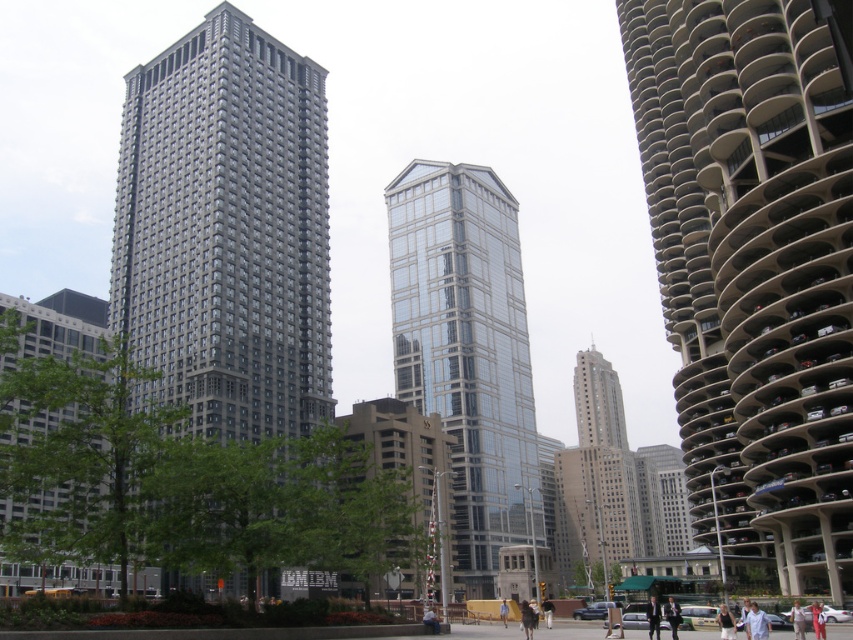
Question: Does light brown fabric pants at center have a larger size compared to light blue jeans at center?

Choices:
 (A) no
 (B) yes

Answer: (B)

Question: Estimate the real-world distances between objects in this image. Which object is farther from the light blue denim jeans at lower right?

Choices:
 (A) beige concrete parking garage at right
 (B) light blue jeans at center
 (C) white cotton shirt at lower right
 (D) dark suit at center

Answer: (A)

Question: Which object appears closest to the camera in this image?

Choices:
 (A) dark suit at center
 (B) light brown fabric pants at center
 (C) white cotton shirt at lower right
 (D) light blue denim jeans at lower right

Answer: (C)

Question: Observing the image, what is the correct spatial positioning of light blue denim jeans at lower right in reference to light brown fabric pants at center?

Choices:
 (A) left
 (B) right

Answer: (A)

Question: Does white cotton shirt at lower right appear on the right side of light blue denim jeans at lower right?

Choices:
 (A) no
 (B) yes

Answer: (A)

Question: Which object is positioned closest to the dark brown leather jacket at center?

Choices:
 (A) light brown fabric pants at center
 (B) dark gray suit at center
 (C) glassy reflective skyscraper at center
 (D) beige concrete parking garage at right

Answer: (B)